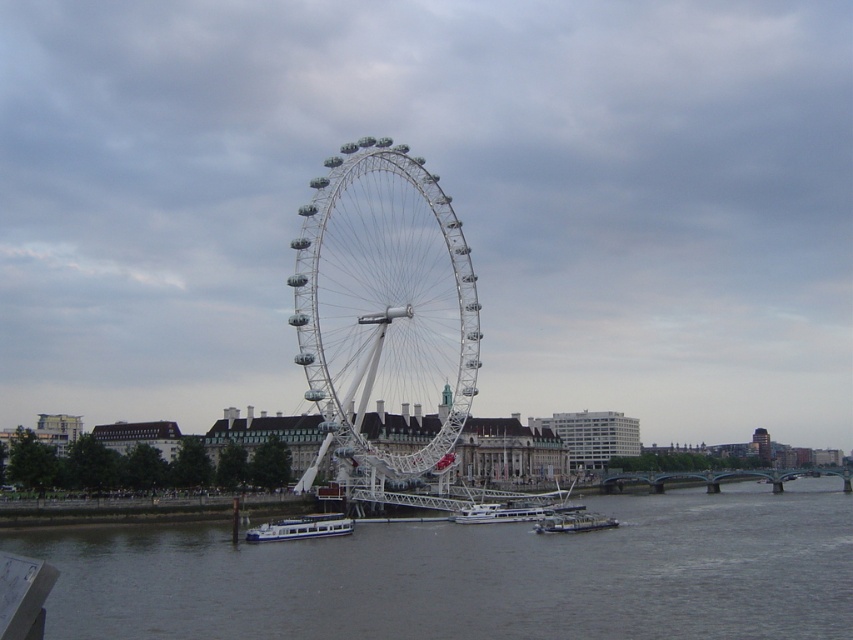
Question: Can you confirm if gray water at lower center is thinner than white glossy boat at center?

Choices:
 (A) no
 (B) yes

Answer: (A)

Question: Estimate the real-world distances between objects in this image. Which object is farther from the white glossy boat at center?

Choices:
 (A) white glossy boat at lower left
 (B) metallic gray barge at lower center

Answer: (A)

Question: Based on their relative distances, which object is farther from the metallic gray barge at lower center?

Choices:
 (A) white metallic ferris wheel at center
 (B) white glossy boat at center
 (C) gray water at lower center

Answer: (A)

Question: Can you confirm if gray water at lower center is positioned above white metallic ferris wheel at center?

Choices:
 (A) yes
 (B) no

Answer: (B)

Question: Among these points, which one is farthest from the camera?

Choices:
 (A) (520, 520)
 (B) (349, 532)
 (C) (805, 506)

Answer: (C)

Question: Can you confirm if white metallic ferris wheel at center is smaller than white glossy boat at lower left?

Choices:
 (A) yes
 (B) no

Answer: (B)